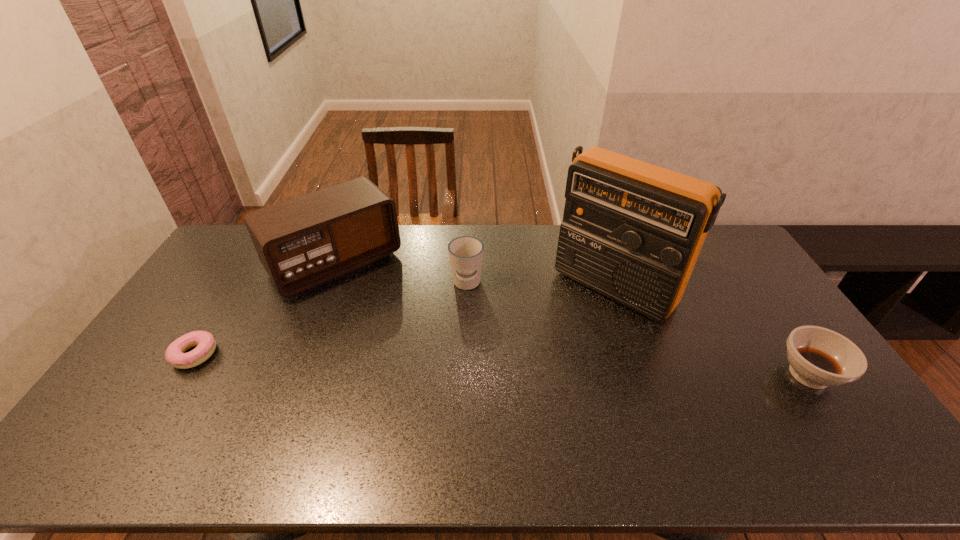
In order to click on free space located 0.270m on the right of the shortest object in this screenshot , I will do `click(309, 355)`.

The width and height of the screenshot is (960, 540). Find the location of `free point located 0.270m on the left of the rightmost object`. free point located 0.270m on the left of the rightmost object is located at coordinates coord(680,375).

You are a GUI agent. You are given a task and a screenshot of the screen. Output one action in this format:
    pyautogui.click(x=<x>, y=<y>)
    Task: Click on the free space located 0.110m with a handle on the side of the third object from left to right
    
    Given the screenshot: What is the action you would take?
    pyautogui.click(x=462, y=322)

This screenshot has width=960, height=540. What are the coordinates of `vacant space situated with a handle on the side of the third object from left to right` in the screenshot? It's located at (464, 308).

The image size is (960, 540). What are the coordinates of `vacant space situated with a handle on the side of the third object from left to right` in the screenshot? It's located at (450, 402).

Identify the location of vacant space located on the front-facing side of the second object from right to left. (520, 383).

The image size is (960, 540). Find the location of `free region located 0.050m on the front-facing side of the second object from right to left`. free region located 0.050m on the front-facing side of the second object from right to left is located at coordinates (575, 326).

Where is `vacant space situated 0.350m on the front-facing side of the second object from right to left`? vacant space situated 0.350m on the front-facing side of the second object from right to left is located at coordinates (516, 388).

Where is `vacant area situated 0.330m on the front-facing side of the shorter radio receiver`? The width and height of the screenshot is (960, 540). vacant area situated 0.330m on the front-facing side of the shorter radio receiver is located at coordinates (416, 357).

The image size is (960, 540). Identify the location of vacant point located 0.370m on the front-facing side of the shorter radio receiver. (422, 366).